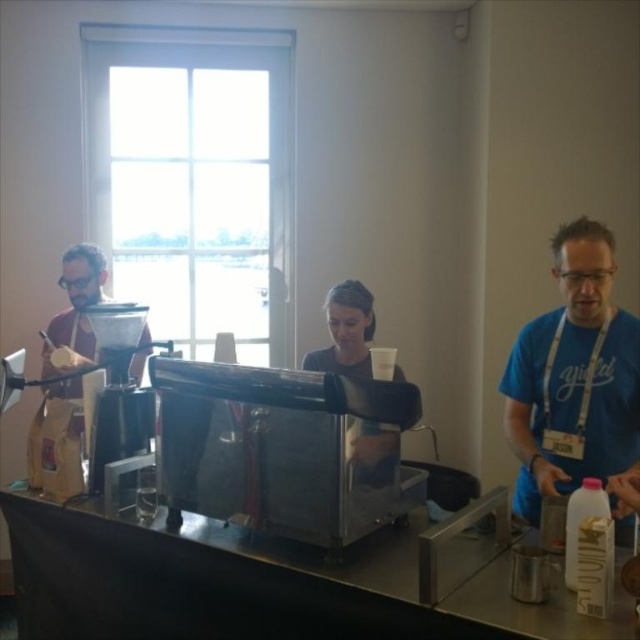
Question: Is metallic silver coffee machine at center thinner than dark gray shirt at center?

Choices:
 (A) no
 (B) yes

Answer: (B)

Question: Which point is closer to the camera taking this photo?

Choices:
 (A) (340, 284)
 (B) (136, 323)

Answer: (B)

Question: Which object is farther from the camera taking this photo?

Choices:
 (A) blue cotton shirt at right
 (B) metallic silver coffee machine at center
 (C) dark gray shirt at center

Answer: (C)

Question: Does metallic silver coffee machine at center appear under dark gray shirt at center?

Choices:
 (A) no
 (B) yes

Answer: (B)

Question: Which of the following is the farthest from the observer?

Choices:
 (A) (596, 380)
 (B) (362, 308)

Answer: (B)

Question: Can you confirm if blue cotton shirt at right is thinner than metallic silver coffee machine at center?

Choices:
 (A) no
 (B) yes

Answer: (A)